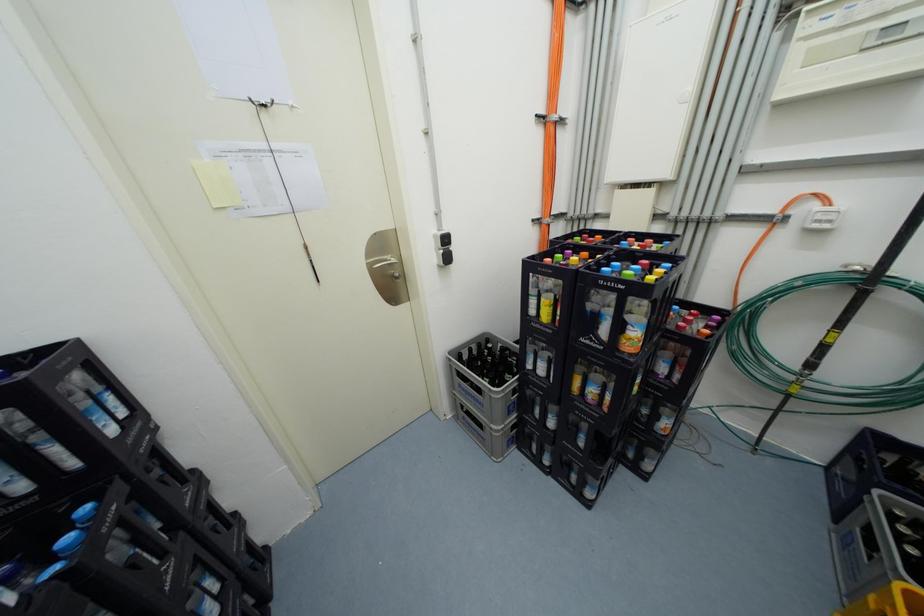
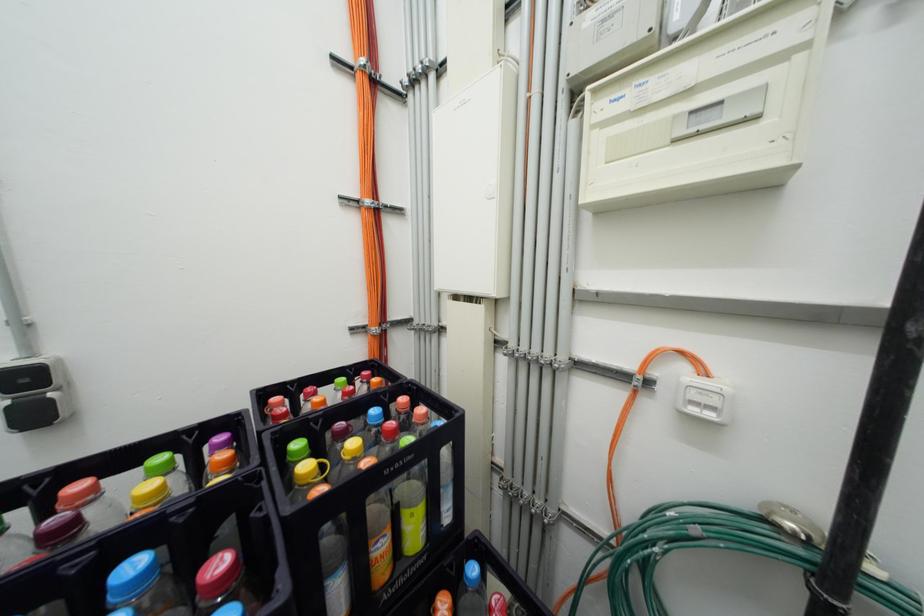
The images are taken continuously from a first-person perspective. In which direction are you moving?

The movement direction of the cameraman is right, forward.